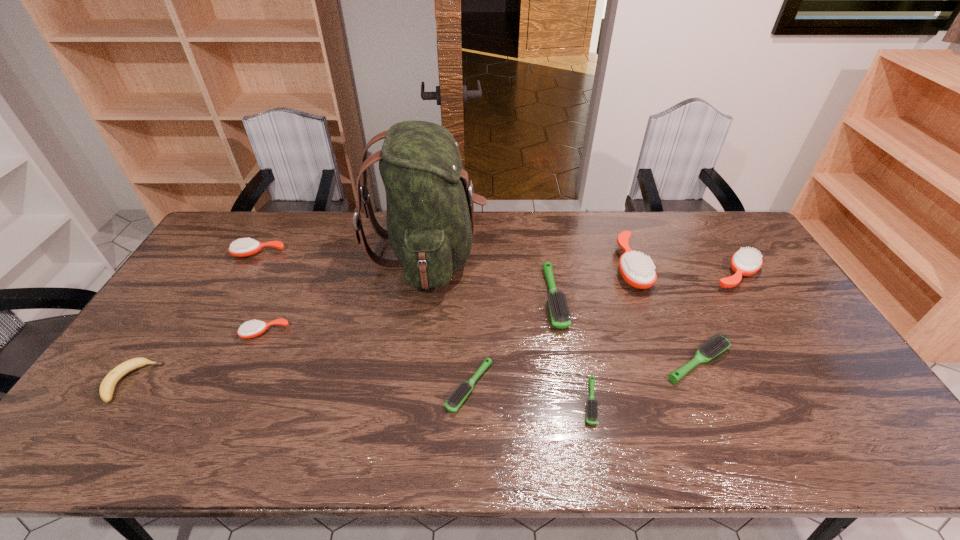
Choose which hairbrush is the nearest neighbor to the biggest light hairbrush. Please provide its 2D coordinates. Your answer should be formatted as a tuple, i.e. [(x, y)], where the tuple contains the x and y coordinates of a point satisfying the conditions above.

[(591, 413)]

In order to click on orange hairbrush that is the second closest one to the rightmost light hairbrush in this screenshot , I will do [745, 262].

Identify which orange hairbrush is the nearest to the second smallest light hairbrush. Please provide its 2D coordinates. Your answer should be formatted as a tuple, i.e. [(x, y)], where the tuple contains the x and y coordinates of a point satisfying the conditions above.

[(250, 329)]

Locate which light hairbrush ranks second in proximity to the green backpack. Please provide its 2D coordinates. Your answer should be formatted as a tuple, i.e. [(x, y)], where the tuple contains the x and y coordinates of a point satisfying the conditions above.

[(456, 399)]

Image resolution: width=960 pixels, height=540 pixels. In order to click on light hairbrush that is the third closest one to the third hairbrush from left to right in this screenshot , I will do `click(718, 343)`.

The image size is (960, 540). I want to click on free space that satisfies the following two spatial constraints: 1. on the front side of the farthest light hairbrush; 2. on the left side of the third biggest orange hairbrush, so click(233, 298).

At what (x,y) coordinates should I click in order to perform the action: click on free spot that satisfies the following two spatial constraints: 1. on the front side of the nearest orange hairbrush; 2. on the left side of the sixth hairbrush from right to left. Please return your answer as a coordinate pair (x, y). This screenshot has height=540, width=960. Looking at the image, I should click on (240, 387).

At what (x,y) coordinates should I click in order to perform the action: click on vacant space that satisfies the following two spatial constraints: 1. on the front side of the third biggest orange hairbrush; 2. on the right side of the seventh tallest hairbrush. Please return your answer as a coordinate pair (x, y). The height and width of the screenshot is (540, 960). Looking at the image, I should click on (183, 387).

Image resolution: width=960 pixels, height=540 pixels. I want to click on free space that satisfies the following two spatial constraints: 1. on the open flap of the backpack; 2. on the left side of the second tallest hairbrush, so click(424, 275).

Where is `free spot that satisfies the following two spatial constraints: 1. on the back side of the second orange hairbrush from right to left; 2. on the open flap of the green backpack`? The height and width of the screenshot is (540, 960). free spot that satisfies the following two spatial constraints: 1. on the back side of the second orange hairbrush from right to left; 2. on the open flap of the green backpack is located at coordinates (625, 254).